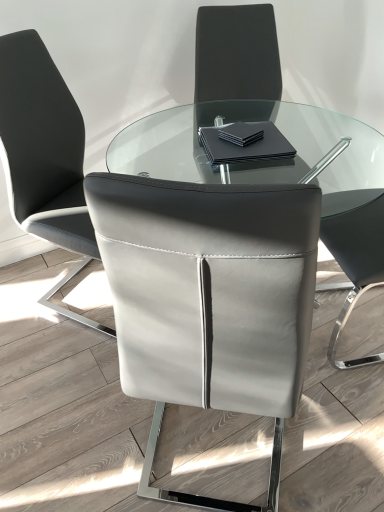
What do you see at coordinates (209, 298) in the screenshot? This screenshot has width=384, height=512. I see `matte gray leather chair at center, the 2th chair when ordered from left to right` at bounding box center [209, 298].

Locate an element on the screen. white leather chair at center, marked as the 2th chair in a right-to-left arrangement is located at coordinates (44, 155).

Looking at this image, between black matte napkin at center and white leather chair at center, marked as the 2th chair in a right-to-left arrangement, which one has more height?

white leather chair at center, marked as the 2th chair in a right-to-left arrangement, is taller.

Based on the photo, between black matte napkin at center and white leather chair at center, positioned as the first chair in left-to-right order, which one has larger size?

Bigger between the two is white leather chair at center, positioned as the first chair in left-to-right order.

Is black matte napkin at center inside or outside of white leather chair at center, marked as the 2th chair in a right-to-left arrangement?

The correct answer is: outside.

Is white leather chair at center, positioned as the first chair in left-to-right order, smaller than matte gray leather chair at center, the 2th chair when ordered from left to right?

No, white leather chair at center, positioned as the first chair in left-to-right order, is not smaller than matte gray leather chair at center, the 2th chair when ordered from left to right.

From the image's perspective, between white leather chair at center, marked as the 2th chair in a right-to-left arrangement, and matte gray leather chair at center, the 2th chair when ordered from left to right, which one is located above?

From the image's view, white leather chair at center, marked as the 2th chair in a right-to-left arrangement, is above.

Considering the relative sizes of white leather chair at center, marked as the 2th chair in a right-to-left arrangement, and matte gray leather chair at center, the 2th chair when ordered from left to right, in the image provided, is white leather chair at center, marked as the 2th chair in a right-to-left arrangement, thinner than matte gray leather chair at center, the 2th chair when ordered from left to right,?

Correct, the width of white leather chair at center, marked as the 2th chair in a right-to-left arrangement, is less than that of matte gray leather chair at center, the 2th chair when ordered from left to right.

Is point (21, 38) in front of point (282, 384)?

That is False.

From the image's perspective, would you say white leather chair at center, positioned as the first chair in left-to-right order, is positioned over black matte napkin at center?

No, from the image's perspective, white leather chair at center, positioned as the first chair in left-to-right order, is not above black matte napkin at center.

Can you see white leather chair at center, marked as the 2th chair in a right-to-left arrangement, touching black matte napkin at center?

No, white leather chair at center, marked as the 2th chair in a right-to-left arrangement, is not touching black matte napkin at center.

From a real-world perspective, is white leather chair at center, marked as the 2th chair in a right-to-left arrangement, below black matte napkin at center?

Yes, from a real-world perspective, white leather chair at center, marked as the 2th chair in a right-to-left arrangement, is under black matte napkin at center.

Considering the positions of objects white leather chair at center, positioned as the first chair in left-to-right order, and black matte napkin at center in the image provided, who is more to the right, white leather chair at center, positioned as the first chair in left-to-right order, or black matte napkin at center?

Positioned to the right is black matte napkin at center.

Looking at this image, between matte gray leather chair at center, which is counted as the 1th chair, starting from the right, and white leather chair at center, positioned as the first chair in left-to-right order, which one has smaller width?

With smaller width is white leather chair at center, positioned as the first chair in left-to-right order.

I want to click on chair that appears on the left of matte gray leather chair at center, which is counted as the 1th chair, starting from the right, so click(x=44, y=155).

Does matte gray leather chair at center, the 2th chair when ordered from left to right, have a smaller size compared to white leather chair at center, marked as the 2th chair in a right-to-left arrangement?

Correct, matte gray leather chair at center, the 2th chair when ordered from left to right, occupies less space than white leather chair at center, marked as the 2th chair in a right-to-left arrangement.

Considering the positions of objects matte gray leather chair at center, the 2th chair when ordered from left to right, and white leather chair at center, positioned as the first chair in left-to-right order, in the image provided, who is behind, matte gray leather chair at center, the 2th chair when ordered from left to right, or white leather chair at center, positioned as the first chair in left-to-right order,?

white leather chair at center, positioned as the first chair in left-to-right order, is more distant.

From the image's perspective, is black matte napkin at center located above or below matte gray leather chair at center, which is counted as the 1th chair, starting from the right?

Based on their image positions, black matte napkin at center is located above matte gray leather chair at center, which is counted as the 1th chair, starting from the right.

From a real-world perspective, who is located lower, black matte napkin at center or matte gray leather chair at center, the 2th chair when ordered from left to right?

From a 3D spatial view, matte gray leather chair at center, the 2th chair when ordered from left to right, is below.

Is black matte napkin at center wider or thinner than matte gray leather chair at center, which is counted as the 1th chair, starting from the right?

In the image, black matte napkin at center appears to be more narrow than matte gray leather chair at center, which is counted as the 1th chair, starting from the right.

Is black matte napkin at center not inside matte gray leather chair at center, which is counted as the 1th chair, starting from the right?

Yes.

From a real-world perspective, which object rests below the other?

From a 3D spatial view, matte gray leather chair at center, the 2th chair when ordered from left to right, is below.

Locate an element on the screen. notebook behind the matte gray leather chair at center, which is counted as the 1th chair, starting from the right is located at coordinates (244, 143).

Considering the positions of points (270, 351) and (249, 159), is point (270, 351) closer to camera compared to point (249, 159)?

That is True.

Is matte gray leather chair at center, which is counted as the 1th chair, starting from the right, oriented towards black matte napkin at center?

No, matte gray leather chair at center, which is counted as the 1th chair, starting from the right, is not oriented towards black matte napkin at center.

Locate an element on the screen. notebook above the white leather chair at center, marked as the 2th chair in a right-to-left arrangement (from a real-world perspective) is located at coordinates (244, 143).

Locate an element on the screen. The height and width of the screenshot is (512, 384). chair located on the right of white leather chair at center, positioned as the first chair in left-to-right order is located at coordinates (209, 298).

Estimate the real-world distances between objects in this image. Which object is further from white leather chair at center, marked as the 2th chair in a right-to-left arrangement, matte gray leather chair at center, the 2th chair when ordered from left to right, or black matte napkin at center?

Among the two, matte gray leather chair at center, the 2th chair when ordered from left to right, is located further to white leather chair at center, marked as the 2th chair in a right-to-left arrangement.

Consider the image. From the image, which object appears to be nearer to matte gray leather chair at center, which is counted as the 1th chair, starting from the right, white leather chair at center, positioned as the first chair in left-to-right order, or black matte napkin at center?

black matte napkin at center is positioned closer to the anchor matte gray leather chair at center, which is counted as the 1th chair, starting from the right.

Considering their positions, is black matte napkin at center positioned closer to white leather chair at center, positioned as the first chair in left-to-right order, than matte gray leather chair at center, which is counted as the 1th chair, starting from the right?

black matte napkin at center is positioned closer to the anchor white leather chair at center, positioned as the first chair in left-to-right order.

From the image, which object appears to be nearer to matte gray leather chair at center, which is counted as the 1th chair, starting from the right, black matte napkin at center or white leather chair at center, positioned as the first chair in left-to-right order?

The object closer to matte gray leather chair at center, which is counted as the 1th chair, starting from the right, is black matte napkin at center.

When comparing their distances from black matte napkin at center, does white leather chair at center, positioned as the first chair in left-to-right order, or matte gray leather chair at center, the 2th chair when ordered from left to right, seem further?

matte gray leather chair at center, the 2th chair when ordered from left to right, lies further to black matte napkin at center than the other object.

Which object lies further to the anchor point black matte napkin at center, matte gray leather chair at center, the 2th chair when ordered from left to right, or white leather chair at center, marked as the 2th chair in a right-to-left arrangement?

Among the two, matte gray leather chair at center, the 2th chair when ordered from left to right, is located further to black matte napkin at center.

Find the location of a particular element. chair between black matte napkin at center and matte gray leather chair at center, the 2th chair when ordered from left to right, in the vertical direction is located at coordinates (44, 155).